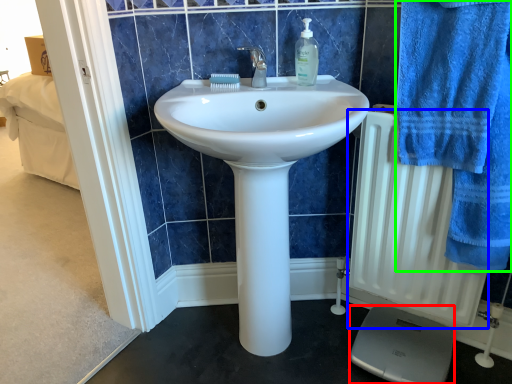
Question: Which object is the closest to the scale (highlighted by a red box)? Choose among these: radiator (highlighted by a blue box) or bath towel (highlighted by a green box).

Choices:
 (A) radiator
 (B) bath towel

Answer: (A)